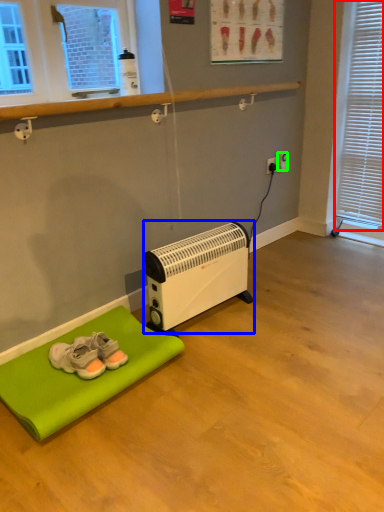
Question: Estimate the real-world distances between objects in this image. Which object is closer to blind (highlighted by a red box), heater (highlighted by a blue box) or electric outlet (highlighted by a green box)?

Choices:
 (A) heater
 (B) electric outlet

Answer: (B)